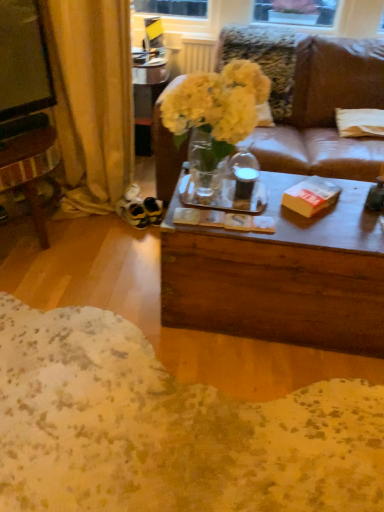
Question: In terms of height, does yellow paper book at center look taller or shorter compared to gold fabric curtain at left?

Choices:
 (A) tall
 (B) short

Answer: (B)

Question: Is point (296, 203) positioned closer to the camera than point (46, 13)?

Choices:
 (A) closer
 (B) farther

Answer: (A)

Question: Estimate the real-world distances between objects in this image. Which object is farther from the metallic silver box at upper center?

Choices:
 (A) white fabric pillow at right
 (B) yellow paper book at center
 (C) gold fabric curtain at left
 (D) translucent glass vase at center

Answer: (B)

Question: Which of these objects is positioned farthest from the white fabric pillow at right?

Choices:
 (A) gold fabric curtain at left
 (B) translucent glass vase at center
 (C) metallic silver box at upper center
 (D) yellow paper book at center

Answer: (A)